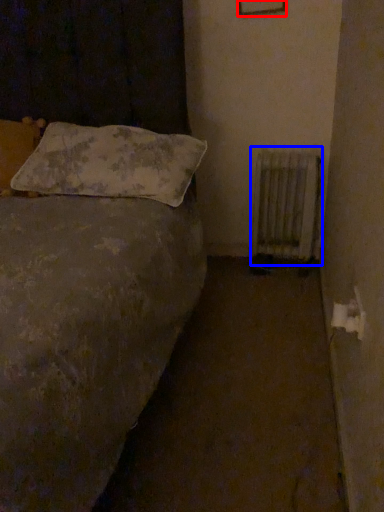
Question: Which object appears closest to the camera in this image, picture frame (highlighted by a red box) or radiator (highlighted by a blue box)?

Choices:
 (A) picture frame
 (B) radiator

Answer: (A)